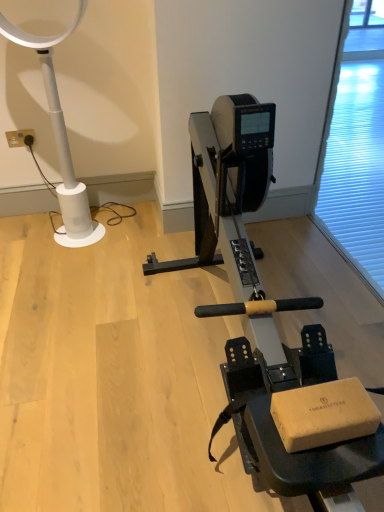
Question: Which is correct: white plastic electric outlet at upper left is inside transparent plastic screen door at right, or outside of it?

Choices:
 (A) outside
 (B) inside

Answer: (A)

Question: From a real-world perspective, relative to transparent plastic screen door at right, is white plastic electric outlet at upper left vertically above or below?

Choices:
 (A) above
 (B) below

Answer: (B)

Question: Estimate the real-world distances between objects in this image. Which object is farther from the white plastic lamp at left?

Choices:
 (A) white plastic electric outlet at upper left
 (B) metallic silver stationary bicycle at center
 (C) transparent plastic screen door at right

Answer: (C)

Question: Which of these objects is positioned closest to the transparent plastic screen door at right?

Choices:
 (A) white plastic lamp at left
 (B) metallic silver stationary bicycle at center
 (C) white plastic electric outlet at upper left

Answer: (B)